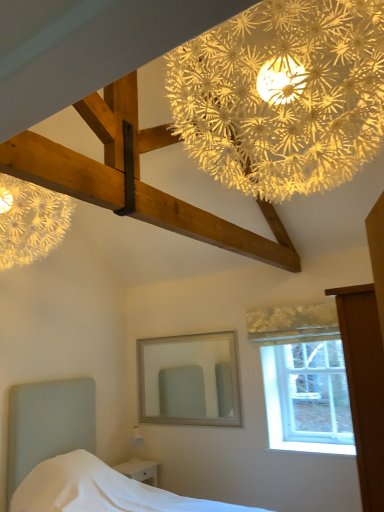
You are a GUI agent. You are given a task and a screenshot of the screen. Output one action in this format:
    pyautogui.click(x=<x>, y=<y>)
    Task: Click on the clear glass window at upper right
    This screenshot has height=512, width=384.
    Given the screenshot: What is the action you would take?
    pyautogui.click(x=313, y=392)

I want to click on white wooden mirror at center, so click(189, 380).

Can illuminated paper flower at upper center be found inside white wooden mirror at center?

That's incorrect, illuminated paper flower at upper center is not inside white wooden mirror at center.

Who is shorter, white wooden mirror at center or illuminated paper flower at upper center?

Standing shorter between the two is white wooden mirror at center.

Which object is thinner, white wooden mirror at center or illuminated paper flower at upper center?

Thinner between the two is white wooden mirror at center.

Is white wooden mirror at center oriented away from illuminated paper flower at upper center?

No, white wooden mirror at center is not facing the opposite direction of illuminated paper flower at upper center.

Between white glossy nightstand at lower left and white wooden mirror at center, which one has larger size?

white wooden mirror at center.

Locate an element on the screen. nightstand below the white wooden mirror at center (from a real-world perspective) is located at coordinates (139, 470).

Is white wooden mirror at center at the back of white glossy nightstand at lower left?

That's not correct — white glossy nightstand at lower left is not looking away from white wooden mirror at center.

Does white wooden mirror at center touch white glossy nightstand at lower left?

No, white wooden mirror at center is not touching white glossy nightstand at lower left.

From the image's perspective, is white wooden mirror at center over white glossy nightstand at lower left?

Yes, from the image's perspective, white wooden mirror at center is over white glossy nightstand at lower left.

Which object is positioned more to the left, white wooden mirror at center or white glossy nightstand at lower left?

white glossy nightstand at lower left is more to the left.

Is white wooden mirror at center positioned with its back to white glossy nightstand at lower left?

white wooden mirror at center is not turned away from white glossy nightstand at lower left.

From the image's perspective, is white glossy nightstand at lower left below clear glass window at upper right?

Correct, white glossy nightstand at lower left appears lower than clear glass window at upper right in the image.

Does point (148, 460) come behind point (327, 395)?

Yes, point (148, 460) is farther from viewer.

Which of these two, white glossy nightstand at lower left or clear glass window at upper right, stands shorter?

white glossy nightstand at lower left is shorter.

Is the depth of white glossy nightstand at lower left less than that of clear glass window at upper right?

No.

How distant is clear glass window at upper right from illuminated paper flower at upper center?

clear glass window at upper right is 2.84 meters away from illuminated paper flower at upper center.

From a real-world perspective, is clear glass window at upper right positioned under illuminated paper flower at upper center based on gravity?

Yes, from a real-world perspective, clear glass window at upper right is beneath illuminated paper flower at upper center.

In the image, is clear glass window at upper right positioned in front of or behind illuminated paper flower at upper center?

clear glass window at upper right is behind illuminated paper flower at upper center.

From the image's perspective, which one is positioned higher, illuminated paper flower at upper center or clear glass window at upper right?

illuminated paper flower at upper center, from the image's perspective.

In the scene shown: Can you tell me how much illuminated paper flower at upper center and clear glass window at upper right differ in facing direction?

They differ by 178 degrees in their facing directions.

Considering the relative sizes of illuminated paper flower at upper center and clear glass window at upper right in the image provided, is illuminated paper flower at upper center thinner than clear glass window at upper right?

No.

Between point (279, 25) and point (278, 370), which one is positioned behind?

The point (278, 370) is farther from the camera.

Relative to illuminated paper flower at upper center, is white glossy nightstand at lower left in front or behind?

Visually, white glossy nightstand at lower left is located behind illuminated paper flower at upper center.

Is white glossy nightstand at lower left aimed at illuminated paper flower at upper center?

No, white glossy nightstand at lower left is not turned towards illuminated paper flower at upper center.

Is white glossy nightstand at lower left far from illuminated paper flower at upper center?

Yes, white glossy nightstand at lower left and illuminated paper flower at upper center are located far from each other.

You are a GUI agent. You are given a task and a screenshot of the screen. Output one action in this format:
    pyautogui.click(x=<x>, y=<y>)
    Task: Click on the flower on the right of white wooden mirror at center
    The image size is (384, 512).
    Given the screenshot: What is the action you would take?
    pyautogui.click(x=283, y=96)

This screenshot has height=512, width=384. What are the coordinates of `mirror in front of the white glossy nightstand at lower left` in the screenshot? It's located at (189, 380).

Looking at this image, which object lies nearer to the anchor point clear glass window at upper right, illuminated paper flower at upper center or white wooden mirror at center?

white wooden mirror at center is positioned closer to the anchor clear glass window at upper right.

Looking at the image, which one is located closer to white glossy nightstand at lower left, white fabric bed at lower left or clear glass window at upper right?

The object closer to white glossy nightstand at lower left is white fabric bed at lower left.

When comparing their distances from illuminated paper flower at upper center, does white glossy nightstand at lower left or clear glass window at upper right seem closer?

Based on the image, clear glass window at upper right appears to be nearer to illuminated paper flower at upper center.

Considering their positions, is white fabric bed at lower left positioned further to white glossy nightstand at lower left than illuminated paper flower at upper center?

illuminated paper flower at upper center.

Considering their positions, is illuminated paper flower at upper center positioned closer to white glossy nightstand at lower left than white fabric bed at lower left?

white fabric bed at lower left is closer to white glossy nightstand at lower left.

Which object lies nearer to the anchor point white glossy nightstand at lower left, white fabric bed at lower left or white wooden mirror at center?

white fabric bed at lower left.

When comparing their distances from illuminated paper flower at upper center, does white wooden mirror at center or white glossy nightstand at lower left seem further?

Among the two, white glossy nightstand at lower left is located further to illuminated paper flower at upper center.

Considering their positions, is illuminated paper flower at upper center positioned further to clear glass window at upper right than white fabric bed at lower left?

illuminated paper flower at upper center is further to clear glass window at upper right.

Where is `bed located between illuminated paper flower at upper center and clear glass window at upper right in the depth direction`? The width and height of the screenshot is (384, 512). bed located between illuminated paper flower at upper center and clear glass window at upper right in the depth direction is located at coordinates (72, 455).

The image size is (384, 512). What are the coordinates of `window screen between illuminated paper flower at upper center and white wooden mirror at center in the front-back direction` in the screenshot? It's located at (313, 392).

Image resolution: width=384 pixels, height=512 pixels. I want to click on mirror between white fabric bed at lower left and white glossy nightstand at lower left along the z-axis, so click(189, 380).

This screenshot has height=512, width=384. Identify the location of mirror situated between white glossy nightstand at lower left and clear glass window at upper right from left to right. (189, 380).